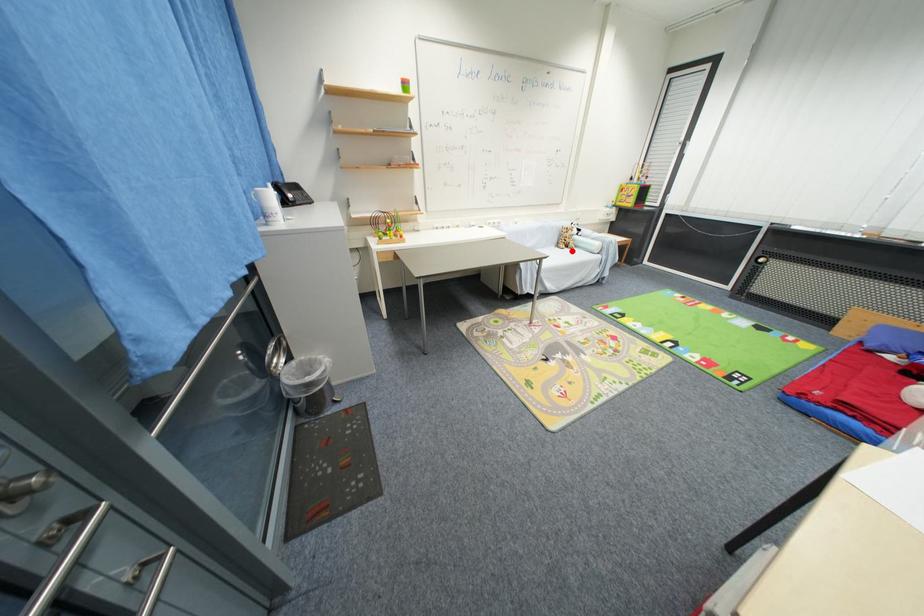
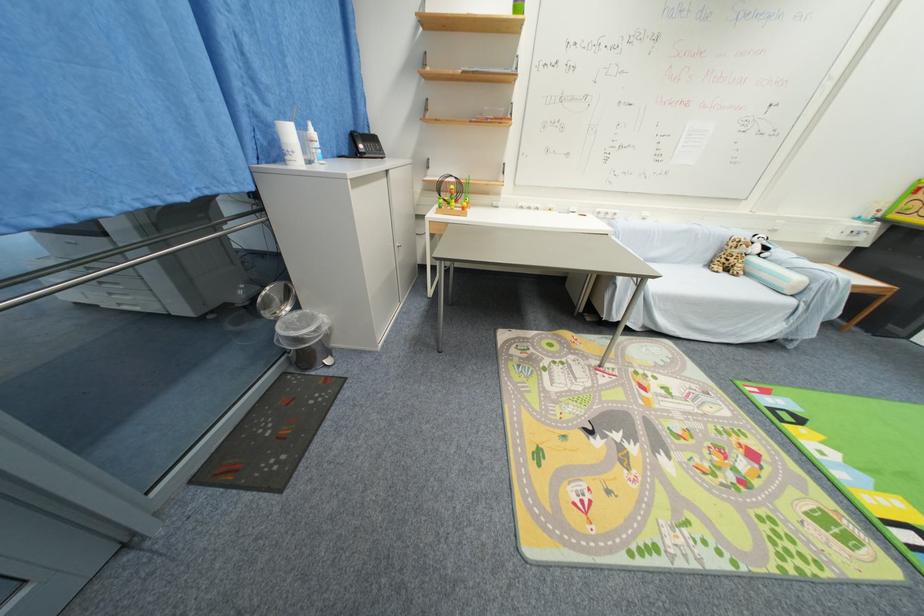
Question: I am providing you with two images of the same scene from different viewpoints. A red point is shown in image1. For the corresponding object point in image2, is it positioned nearer or farther from the camera?

Choices:
 (A) Nearer
 (B) Farther

Answer: (A)